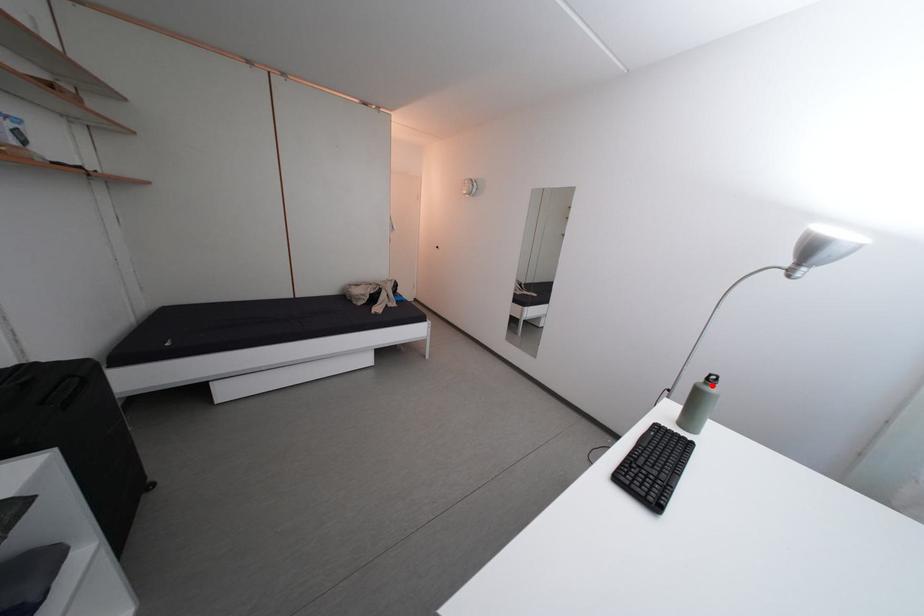
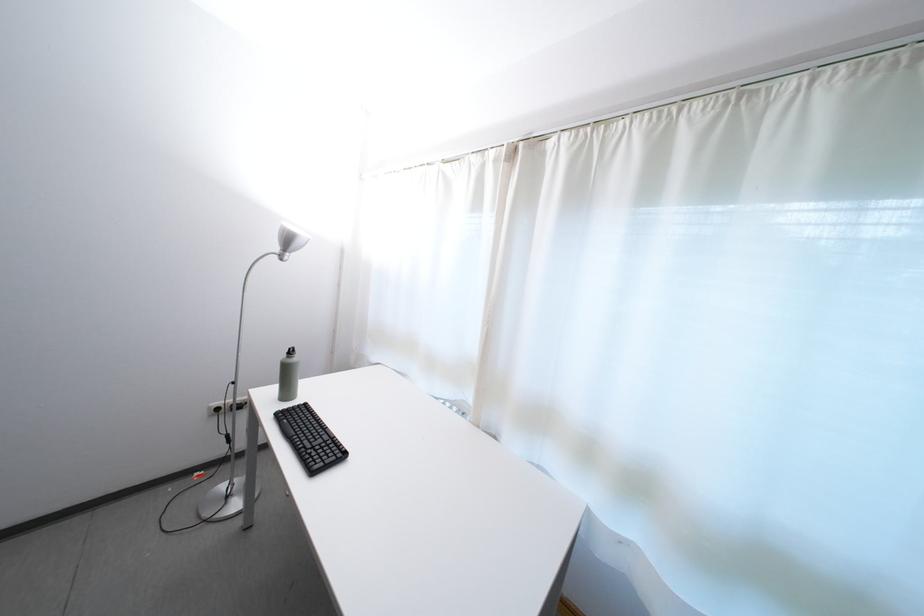
The point at the highlighted location is marked in the first image. Where is the corresponding point in the second image?

(294, 361)